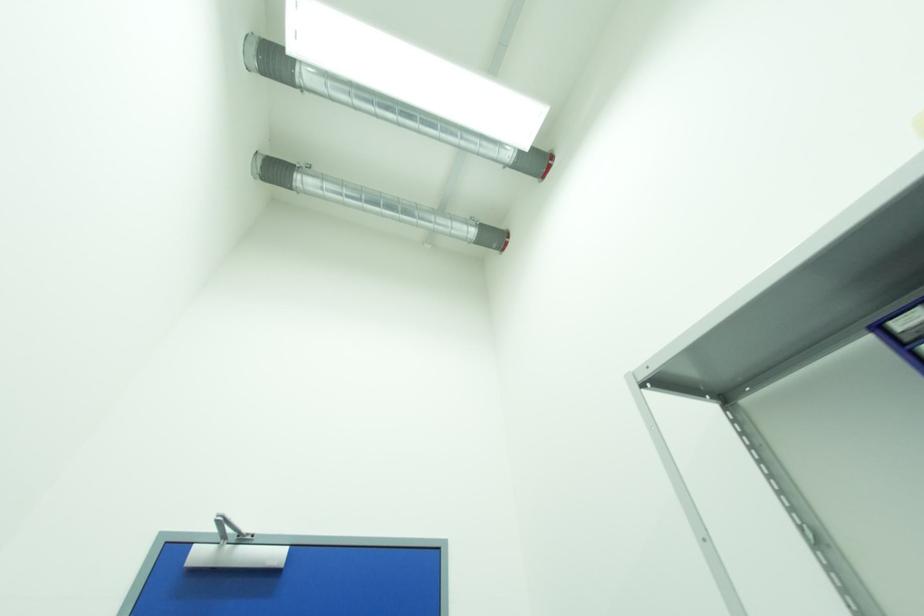
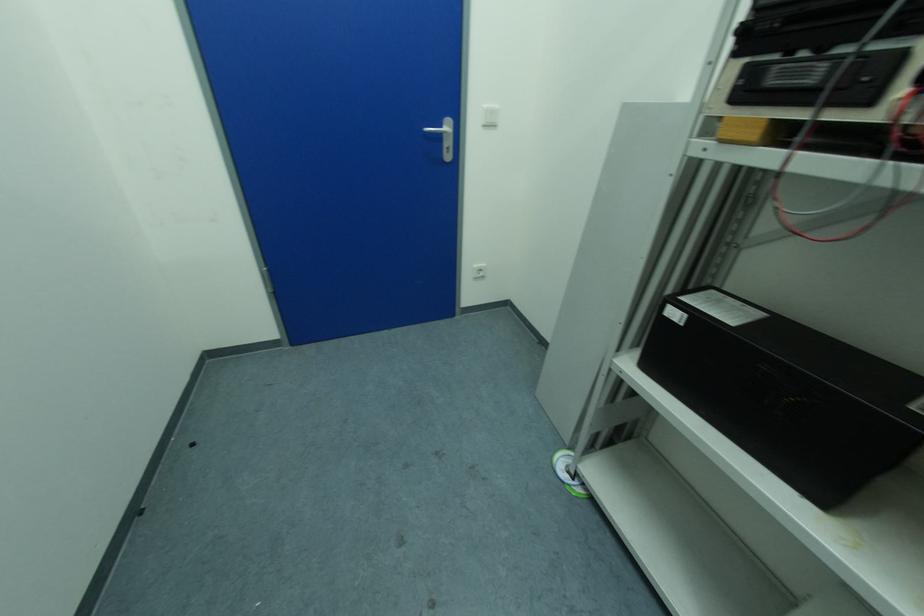
Question: The first image is from the beginning of the video and the second image is from the end. How did the camera likely rotate when shooting the video?

Choices:
 (A) Left
 (B) Right
 (C) Up
 (D) Down

Answer: (D)